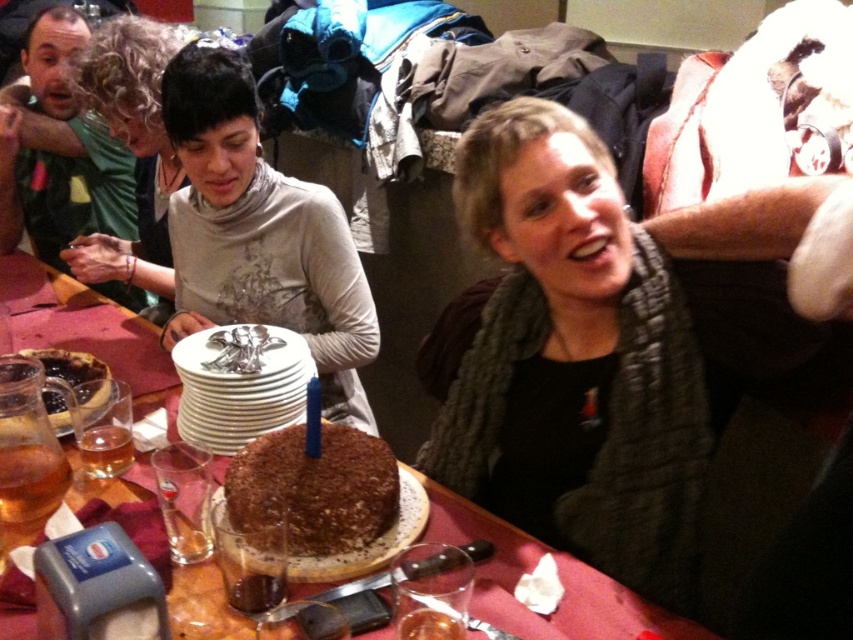
Is matte silver cake at center closer to the viewer compared to brown textured cake at center?

No.

At what (x,y) coordinates should I click in order to perform the action: click on matte silver cake at center. Please return your answer as a coordinate pair (x, y). Image resolution: width=853 pixels, height=640 pixels. Looking at the image, I should click on (259, 234).

Which is in front, point (252, 321) or point (581, 582)?

Point (581, 582) is in front.

Identify the location of matte silver cake at center. The image size is (853, 640). (259, 234).

Can you confirm if matte silver cake at center is positioned above brown crumbly cake at center?

Correct, matte silver cake at center is located above brown crumbly cake at center.

Does matte silver cake at center appear on the left side of brown crumbly cake at center?

No, matte silver cake at center is not to the left of brown crumbly cake at center.

Does point (343, 403) lie behind point (67, 371)?

Yes.

The height and width of the screenshot is (640, 853). In order to click on matte silver cake at center in this screenshot , I will do 259,234.

Is matte silver cake at center smaller than chocolate crumbly cake at center?

No.

Who is shorter, matte silver cake at center or chocolate crumbly cake at center?

chocolate crumbly cake at center is shorter.

Between point (223, 154) and point (335, 500), which one is positioned in front?

Positioned in front is point (335, 500).

Locate an element on the screen. This screenshot has height=640, width=853. matte silver cake at center is located at coordinates [259, 234].